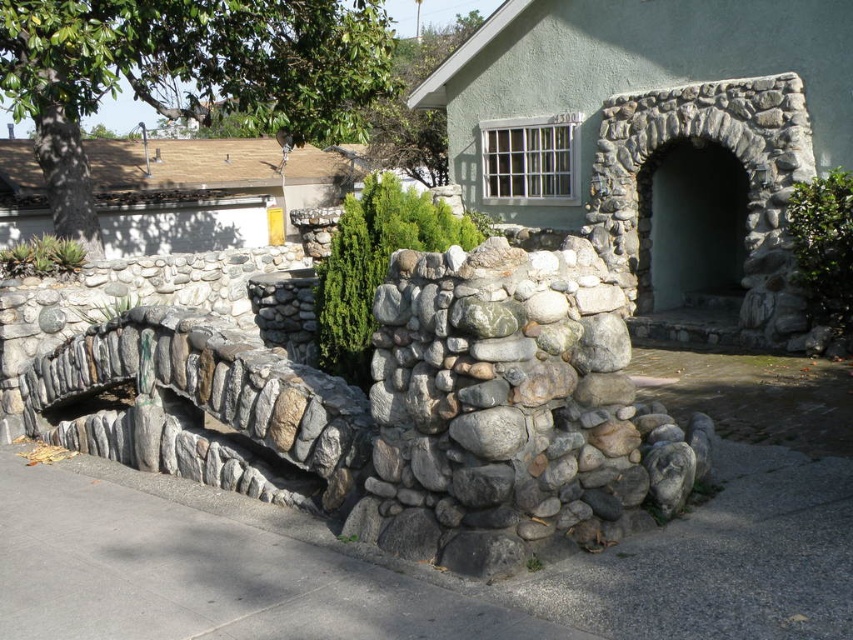
You are standing in front of the residential area with the stone wall and arched entrance. You notice two points marked on the wall at coordinates point [834,445] and point [415,605]. Which of these points is closer to your current position?

Point [415,605] is closer to your current position because it is less further to the camera than point [834,445], which is further away.

You are standing on the gray concrete pavement at lower left and want to walk to the gray concrete pavement at center. Which direction should you move in?

You should move downward to reach the gray concrete pavement at center since it is located below the gray concrete pavement at lower left.